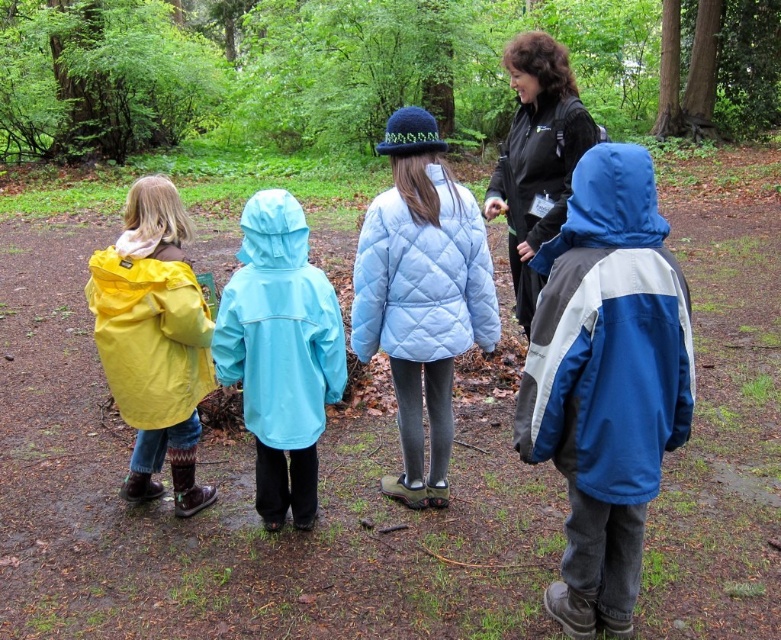
Who is more forward, (369, 253) or (136, 273)?

Point (369, 253) is more forward.

Does light blue quilted jacket at center have a greater width compared to yellow waterproof jacket at left?

Yes, light blue quilted jacket at center is wider than yellow waterproof jacket at left.

Is point (352, 305) farther from camera compared to point (166, 333)?

No, (352, 305) is in front of (166, 333).

Where is `light blue quilted jacket at center`? light blue quilted jacket at center is located at coordinates (423, 276).

Can you confirm if green leafy forest at upper center is wider than light blue waterproof jacket at center?

Indeed, green leafy forest at upper center has a greater width compared to light blue waterproof jacket at center.

Can you confirm if green leafy forest at upper center is taller than light blue waterproof jacket at center?

Yes.

Is point (664, 93) positioned in front of point (289, 378)?

No, it is not.

This screenshot has height=640, width=781. What are the coordinates of `green leafy forest at upper center` in the screenshot? It's located at (366, 70).

Who is shorter, light blue quilted jacket at center or black matte jacket at upper center?

black matte jacket at upper center

Who is lower down, light blue quilted jacket at center or black matte jacket at upper center?

light blue quilted jacket at center is lower down.

Does point (471, 324) lie in front of point (544, 58)?

That is True.

Where is `light blue quilted jacket at center`? Image resolution: width=781 pixels, height=640 pixels. light blue quilted jacket at center is located at coordinates (423, 276).